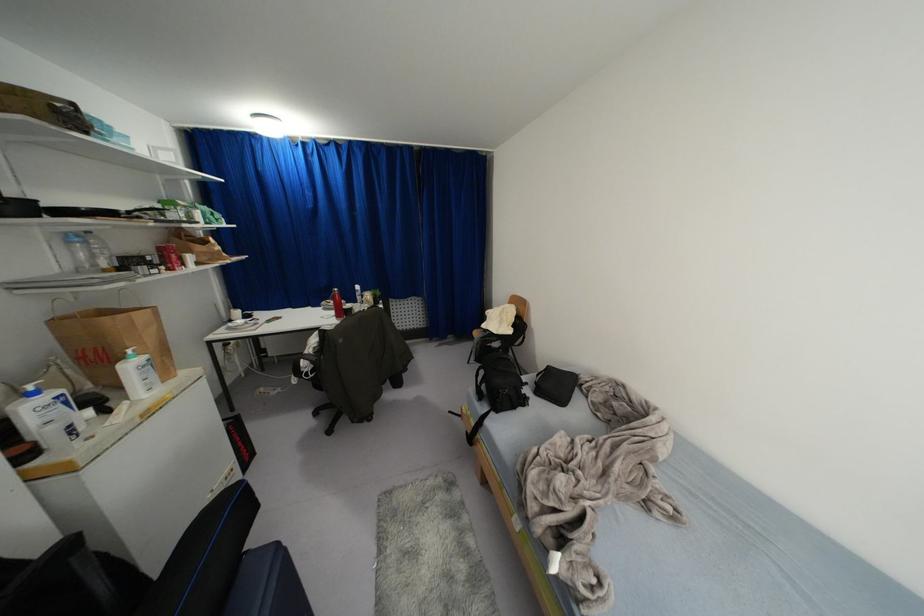
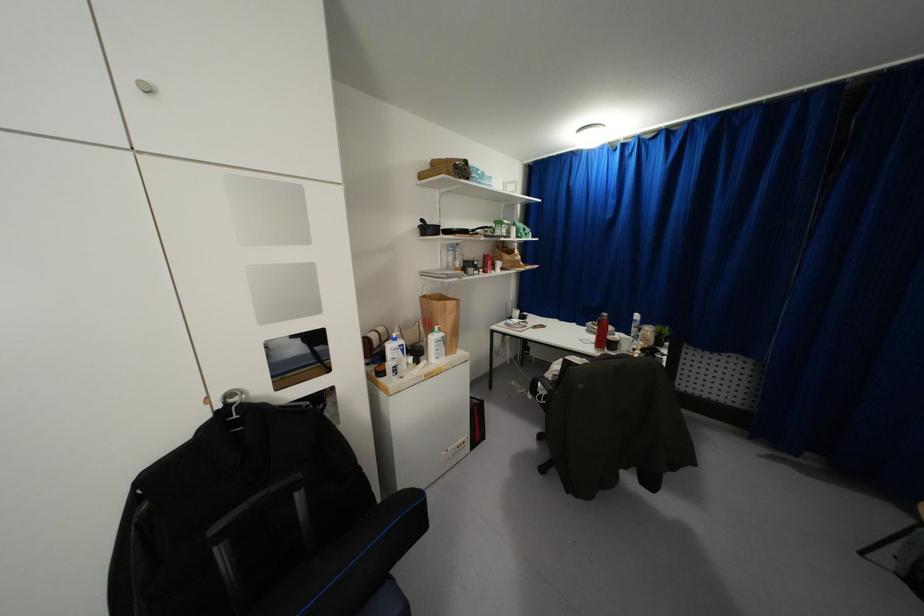
Question: How did the camera likely rotate?

Choices:
 (A) Left
 (B) Right
 (C) Up
 (D) Down

Answer: (A)